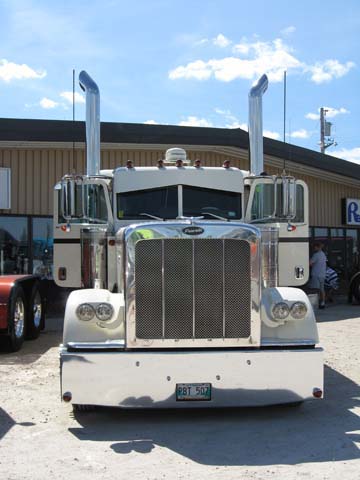
You are a GUI agent. You are given a task and a screenshot of the screen. Output one action in this format:
    pyautogui.click(x=<x>, y=<y>)
    Task: Click on the doors
    The width and height of the screenshot is (360, 480).
    Given the screenshot: What is the action you would take?
    pyautogui.click(x=73, y=251), pyautogui.click(x=292, y=242)